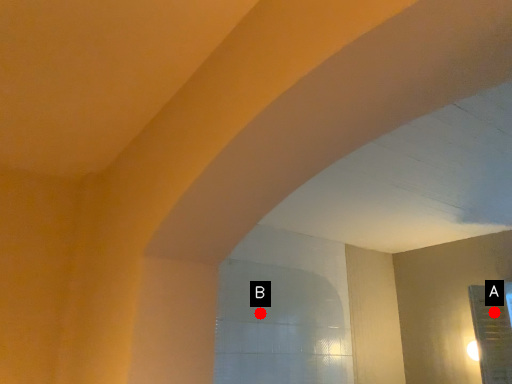
Question: Two points are circled on the image, labeled by A and B beside each circle. Which point appears farthest from the camera in this image?

Choices:
 (A) A is further
 (B) B is further

Answer: (B)